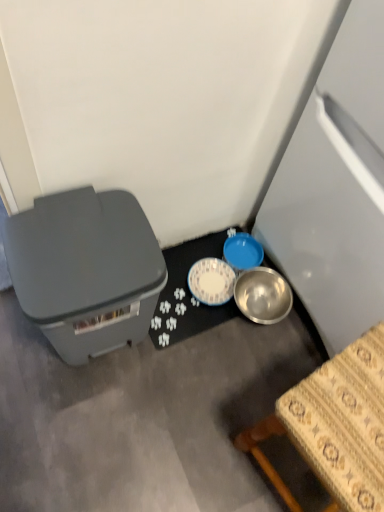
Image resolution: width=384 pixels, height=512 pixels. What are the coordinates of `satin white refrigerator at right` in the screenshot? It's located at (336, 187).

This screenshot has width=384, height=512. Describe the element at coordinates (242, 252) in the screenshot. I see `blue plastic bowl at center-right` at that location.

The width and height of the screenshot is (384, 512). Describe the element at coordinates (188, 294) in the screenshot. I see `metallic silver bowl at lower center` at that location.

Where is `wooden table at lower right`? The image size is (384, 512). wooden table at lower right is located at coordinates (335, 426).

Where is `matte gray storage box at left`? matte gray storage box at left is located at coordinates (86, 270).

Is blue plastic bowl at center-right oriented towards matte gray storage box at left?

No, blue plastic bowl at center-right is not aimed at matte gray storage box at left.

Where is `storage box in front of the blue plastic bowl at center-right`? storage box in front of the blue plastic bowl at center-right is located at coordinates (86, 270).

Measure the distance from blue plastic bowl at center-right to matte gray storage box at left.

The distance of blue plastic bowl at center-right from matte gray storage box at left is 54.68 centimeters.

From a real-world perspective, relative to matte gray storage box at left, is blue plastic bowl at center-right vertically above or below?

Clearly, from a real-world perspective, blue plastic bowl at center-right is below matte gray storage box at left.

Considering the sizes of objects satin white refrigerator at right and matte gray storage box at left in the image provided, who is shorter, satin white refrigerator at right or matte gray storage box at left?

Standing shorter between the two is matte gray storage box at left.

Is satin white refrigerator at right bigger than matte gray storage box at left?

Indeed, satin white refrigerator at right has a larger size compared to matte gray storage box at left.

Are satin white refrigerator at right and matte gray storage box at left far apart?

No, satin white refrigerator at right is not far away from matte gray storage box at left.

Is satin white refrigerator at right facing away from matte gray storage box at left?

No, satin white refrigerator at right's orientation is not away from matte gray storage box at left.

Who is taller, matte gray storage box at left or wooden table at lower right?

wooden table at lower right.

Would you say matte gray storage box at left is inside or outside wooden table at lower right?

matte gray storage box at left is located beyond the bounds of wooden table at lower right.

Considering the positions of objects matte gray storage box at left and wooden table at lower right in the image provided, who is behind, matte gray storage box at left or wooden table at lower right?

matte gray storage box at left is further from the camera.

From a real-world perspective, is matte gray storage box at left positioned above or below wooden table at lower right?

In terms of real-world spatial position, matte gray storage box at left is below wooden table at lower right.

Would you consider metallic silver bowl at lower center to be distant from blue plastic bowl at center-right?

No, there isn't a large distance between metallic silver bowl at lower center and blue plastic bowl at center-right.

Between metallic silver bowl at lower center and blue plastic bowl at center-right, which one has larger width?

metallic silver bowl at lower center is wider.

Can you tell me how much metallic silver bowl at lower center and blue plastic bowl at center-right differ in facing direction?

The angle between the facing direction of metallic silver bowl at lower center and the facing direction of blue plastic bowl at center-right is 0.428 degrees.

Is metallic silver bowl at lower center to the right of blue plastic bowl at center-right from the viewer's perspective?

Incorrect, metallic silver bowl at lower center is not on the right side of blue plastic bowl at center-right.

From a real-world perspective, is blue plastic bowl at center-right positioned over satin white refrigerator at right based on gravity?

Actually, blue plastic bowl at center-right is physically below satin white refrigerator at right in the real world.

Would you say blue plastic bowl at center-right is outside satin white refrigerator at right?

Yes, blue plastic bowl at center-right is outside of satin white refrigerator at right.

Is point (251, 266) closer or farther from the camera than point (299, 274)?

Point (251, 266).

Identify the location of refrigerator that appears in front of the blue plastic bowl at center-right. This screenshot has height=512, width=384. (336, 187).

Is matte gray storage box at left surrounding satin white refrigerator at right?

Definitely not — satin white refrigerator at right is not inside matte gray storage box at left.

Is matte gray storage box at left to the left of satin white refrigerator at right from the viewer's perspective?

Correct, you'll find matte gray storage box at left to the left of satin white refrigerator at right.

Is point (77, 357) less distant than point (332, 302)?

No.

Is matte gray storage box at left bigger or smaller than satin white refrigerator at right?

Clearly, matte gray storage box at left is smaller in size than satin white refrigerator at right.

Is satin white refrigerator at right beside wooden table at lower right?

No, satin white refrigerator at right is not touching wooden table at lower right.

Looking at the image, does satin white refrigerator at right seem bigger or smaller compared to wooden table at lower right?

Clearly, satin white refrigerator at right is larger in size than wooden table at lower right.

Looking at this image, does satin white refrigerator at right have a greater width compared to wooden table at lower right?

Yes.

Choose the correct answer: Is satin white refrigerator at right inside wooden table at lower right or outside it?

satin white refrigerator at right cannot be found inside wooden table at lower right.

Where is `bowl located behind the matte gray storage box at left`? The width and height of the screenshot is (384, 512). bowl located behind the matte gray storage box at left is located at coordinates (242, 252).

Where is `storage box on the left of satin white refrigerator at right`? storage box on the left of satin white refrigerator at right is located at coordinates (86, 270).

Looking at the image, which one is located closer to matte gray storage box at left, satin white refrigerator at right or blue plastic bowl at center-right?

satin white refrigerator at right.

Looking at the image, which one is located further to metallic silver bowl at lower center, wooden table at lower right or satin white refrigerator at right?

Among the two, wooden table at lower right is located further to metallic silver bowl at lower center.

From the image, which object appears to be nearer to blue plastic bowl at center-right, wooden table at lower right or metallic silver bowl at lower center?

metallic silver bowl at lower center.

Estimate the real-world distances between objects in this image. Which object is closer to metallic silver bowl at lower center, satin white refrigerator at right or wooden table at lower right?

Based on the image, satin white refrigerator at right appears to be nearer to metallic silver bowl at lower center.

Considering their positions, is satin white refrigerator at right positioned further to wooden table at lower right than blue plastic bowl at center-right?

blue plastic bowl at center-right is positioned further to the anchor wooden table at lower right.

Estimate the real-world distances between objects in this image. Which object is closer to matte gray storage box at left, satin white refrigerator at right or wooden table at lower right?

wooden table at lower right is positioned closer to the anchor matte gray storage box at left.

Which object lies nearer to the anchor point metallic silver bowl at lower center, satin white refrigerator at right or blue plastic bowl at center-right?

Based on the image, blue plastic bowl at center-right appears to be nearer to metallic silver bowl at lower center.

Considering their positions, is matte gray storage box at left positioned further to metallic silver bowl at lower center than satin white refrigerator at right?

satin white refrigerator at right is positioned further to the anchor metallic silver bowl at lower center.

Find the location of `furniture between satin white refrigerator at right and metallic silver bowl at lower center in the front-back direction`. furniture between satin white refrigerator at right and metallic silver bowl at lower center in the front-back direction is located at coordinates (335, 426).

Find the location of `table between matte gray storage box at left and blue plastic bowl at center-right along the z-axis`. table between matte gray storage box at left and blue plastic bowl at center-right along the z-axis is located at coordinates (188, 294).

Where is `table between satin white refrigerator at right and blue plastic bowl at center-right from front to back`? This screenshot has width=384, height=512. table between satin white refrigerator at right and blue plastic bowl at center-right from front to back is located at coordinates (188, 294).

Where is `storage box located between wooden table at lower right and blue plastic bowl at center-right in the depth direction`? storage box located between wooden table at lower right and blue plastic bowl at center-right in the depth direction is located at coordinates (86, 270).